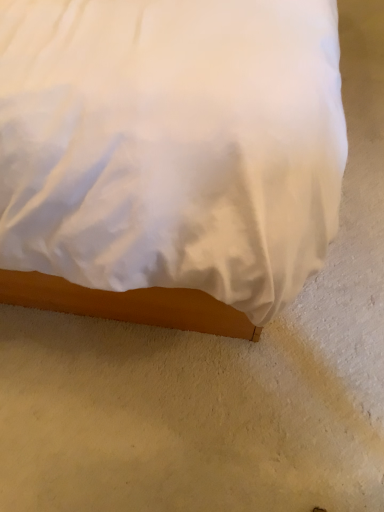
Question: Should I look upward or downward to see white satin bed at center?

Choices:
 (A) up
 (B) down

Answer: (A)